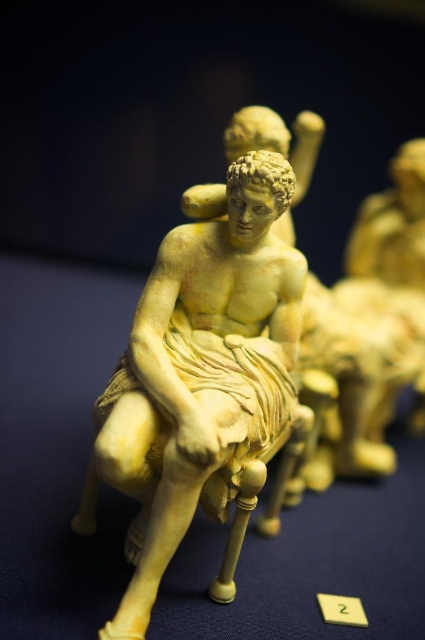
Question: Is matte yellow statue at center closer to the viewer compared to yellow plastic number at center?

Choices:
 (A) yes
 (B) no

Answer: (A)

Question: Is matte yellow statue at center below yellow plastic number at center?

Choices:
 (A) no
 (B) yes

Answer: (A)

Question: Which point is farther to the camera?

Choices:
 (A) yellow plastic number at center
 (B) matte yellow statue at center

Answer: (A)

Question: Can you confirm if matte yellow statue at center is bigger than yellow plastic number at center?

Choices:
 (A) yes
 (B) no

Answer: (A)

Question: Which point is farther from the camera taking this photo?

Choices:
 (A) (252, 275)
 (B) (346, 605)

Answer: (B)